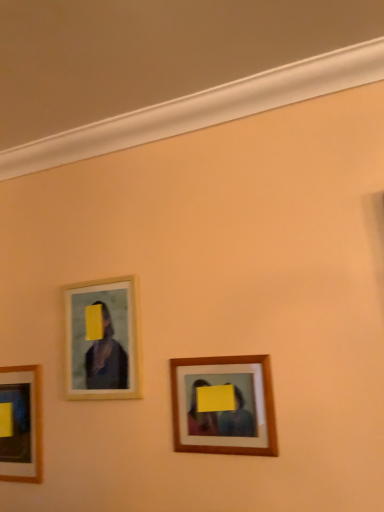
Question: Considering the relative sizes of wooden frame at upper left, positioned as the second picture frame in front-to-back order, and matte wooden picture frame at lower left, placed as the 3th picture frame when sorted from front to back, in the image provided, is wooden frame at upper left, positioned as the second picture frame in front-to-back order, smaller than matte wooden picture frame at lower left, placed as the 3th picture frame when sorted from front to back,?

Choices:
 (A) yes
 (B) no

Answer: (A)

Question: Is wooden frame at upper left, positioned as the second picture frame in front-to-back order, thinner than matte wooden picture frame at lower left, positioned as the 3th picture frame in right-to-left order?

Choices:
 (A) no
 (B) yes

Answer: (B)

Question: Is wooden frame at upper left, the 2th picture frame when ordered from back to front, in contact with matte wooden picture frame at lower left, the first picture frame positioned from the left?

Choices:
 (A) yes
 (B) no

Answer: (B)

Question: Is wooden frame at upper left, the 2th picture frame when ordered from back to front, positioned with its back to matte wooden picture frame at lower left, positioned as the 3th picture frame in right-to-left order?

Choices:
 (A) no
 (B) yes

Answer: (A)

Question: Is wooden frame at upper left, positioned as the second picture frame in front-to-back order, positioned in front of matte wooden picture frame at lower left, positioned as the 3th picture frame in right-to-left order?

Choices:
 (A) yes
 (B) no

Answer: (A)

Question: Is wooden frame at upper left, which is the 2th picture frame in left-to-right order, wider than matte wooden picture frame at lower left, placed as the 3th picture frame when sorted from front to back?

Choices:
 (A) no
 (B) yes

Answer: (A)

Question: From the image's perspective, is matte wooden picture frame at lower left, placed as the 3th picture frame when sorted from front to back, over wooden frame at center, acting as the first picture frame starting from the right?

Choices:
 (A) no
 (B) yes

Answer: (A)

Question: Is matte wooden picture frame at lower left, the first picture frame positioned from the left, wider than wooden frame at center, arranged as the 1th picture frame when viewed from the front?

Choices:
 (A) yes
 (B) no

Answer: (A)

Question: Does matte wooden picture frame at lower left, which is counted as the 1th picture frame, starting from the back, appear on the left side of wooden frame at center, the third picture frame from the back?

Choices:
 (A) yes
 (B) no

Answer: (A)

Question: Is matte wooden picture frame at lower left, positioned as the 3th picture frame in right-to-left order, shorter than wooden frame at center, acting as the first picture frame starting from the right?

Choices:
 (A) yes
 (B) no

Answer: (B)

Question: Is matte wooden picture frame at lower left, which is counted as the 1th picture frame, starting from the back, at the right side of wooden frame at center, arranged as the 1th picture frame when viewed from the front?

Choices:
 (A) yes
 (B) no

Answer: (B)

Question: From the image's perspective, is matte wooden picture frame at lower left, which is counted as the 1th picture frame, starting from the back, below wooden frame at center, the third picture frame from the back?

Choices:
 (A) no
 (B) yes

Answer: (B)

Question: Considering the relative sizes of wooden frame at upper left, which is the 2th picture frame in left-to-right order, and wooden frame at center, the third picture frame from the back, in the image provided, is wooden frame at upper left, which is the 2th picture frame in left-to-right order, bigger than wooden frame at center, the third picture frame from the back,?

Choices:
 (A) yes
 (B) no

Answer: (A)